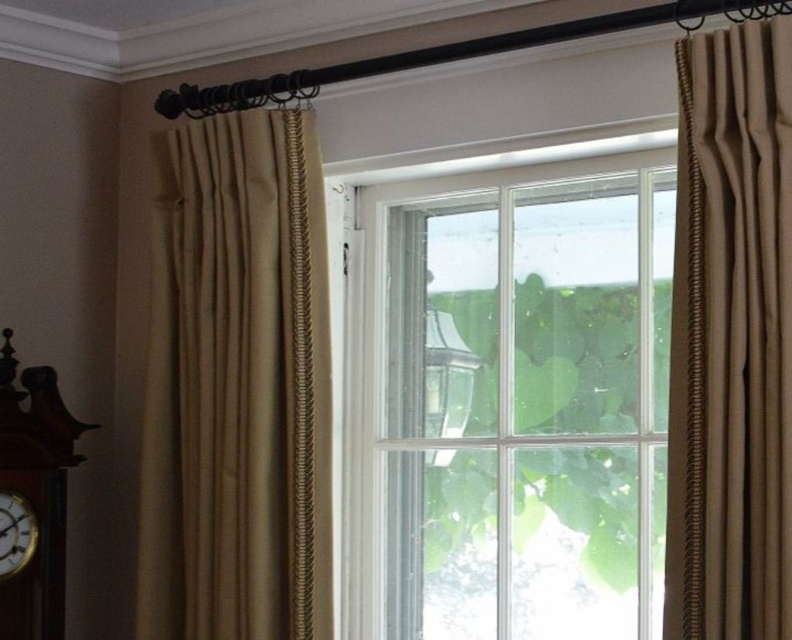
Question: Can you confirm if wooden clock at left is positioned above wooden clock at lower left?

Choices:
 (A) yes
 (B) no

Answer: (A)

Question: Can you confirm if wooden clock at left is positioned above wooden clock at lower left?

Choices:
 (A) yes
 (B) no

Answer: (A)

Question: Which object is farther from the camera taking this photo?

Choices:
 (A) wooden clock at lower left
 (B) wooden clock at left
 (C) clear glass lamp at center
 (D) beige textured curtain at right

Answer: (C)

Question: Is clear glass window at center smaller than wooden clock at left?

Choices:
 (A) yes
 (B) no

Answer: (B)

Question: Which object appears closest to the camera in this image?

Choices:
 (A) clear glass lamp at center
 (B) clear glass window at center
 (C) beige textured curtain at left
 (D) wooden clock at lower left

Answer: (D)

Question: Estimate the real-world distances between objects in this image. Which object is farther from the beige textured curtain at right?

Choices:
 (A) clear glass window at center
 (B) clear glass lamp at center
 (C) wooden clock at left

Answer: (C)